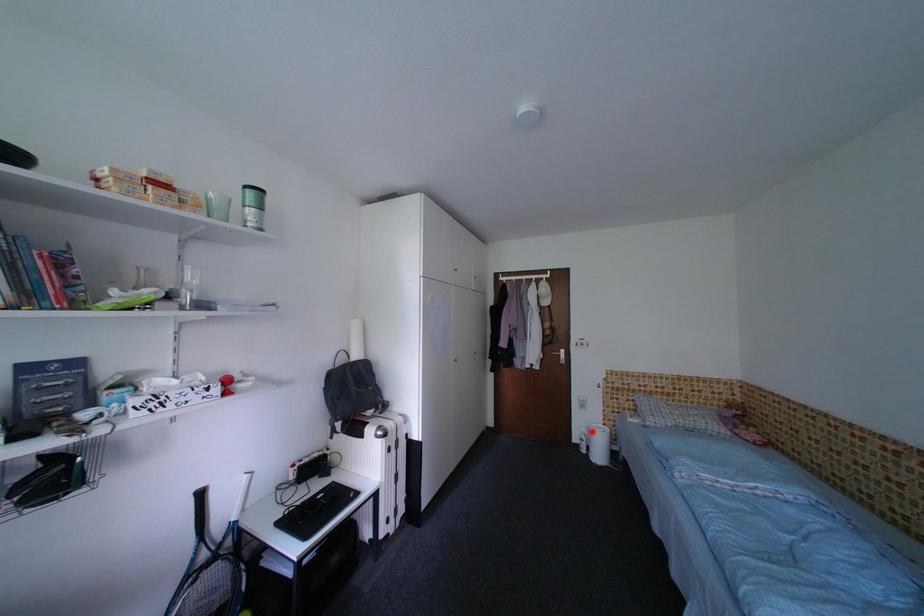
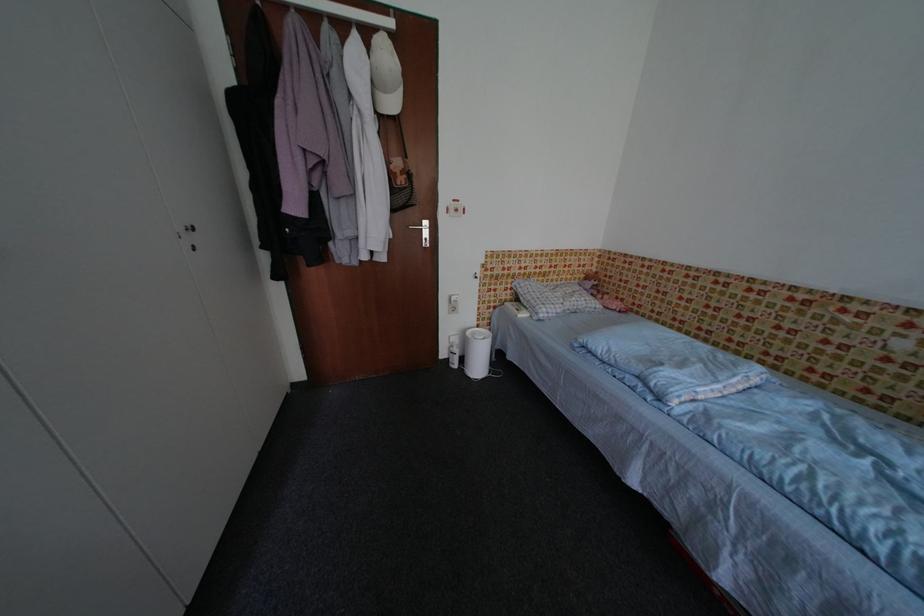
Where in the second image is the point corresponding to the highlighted location from the first image?

(464, 342)